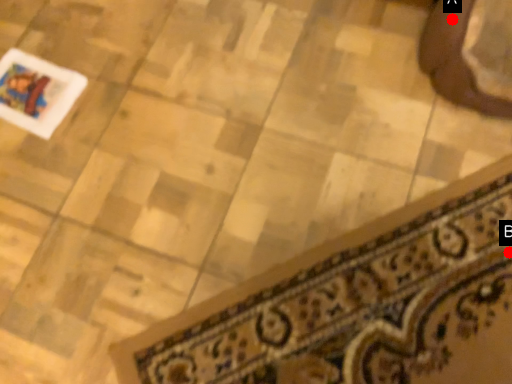
Question: Two points are circled on the image, labeled by A and B beside each circle. Which point is farther from the camera taking this photo?

Choices:
 (A) A is further
 (B) B is further

Answer: (A)